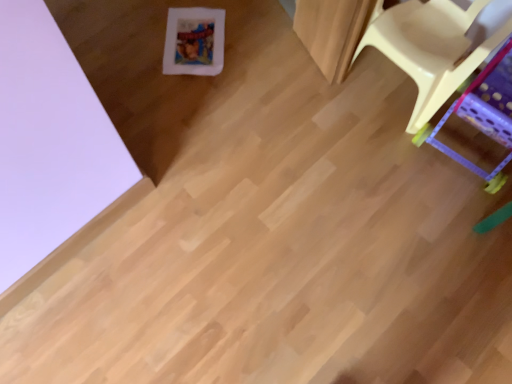
Question: Is matte plastic chair at right, which is the first furniture from left to right, located within yellow plastic chair at right, marked as the second furniture in a left-to-right arrangement?

Choices:
 (A) yes
 (B) no

Answer: (B)

Question: Is yellow plastic chair at right, marked as the second furniture in a left-to-right arrangement, thinner than matte plastic chair at right, which is the first furniture from left to right?

Choices:
 (A) yes
 (B) no

Answer: (B)

Question: From a real-world perspective, is yellow plastic chair at right, marked as the second furniture in a left-to-right arrangement, on matte plastic chair at right, the 2th furniture viewed from the right?

Choices:
 (A) no
 (B) yes

Answer: (A)

Question: Considering the relative sizes of yellow plastic chair at right, marked as the second furniture in a left-to-right arrangement, and matte plastic chair at right, the 2th furniture viewed from the right, in the image provided, is yellow plastic chair at right, marked as the second furniture in a left-to-right arrangement, taller than matte plastic chair at right, the 2th furniture viewed from the right,?

Choices:
 (A) yes
 (B) no

Answer: (B)

Question: Can you confirm if yellow plastic chair at right, marked as the second furniture in a left-to-right arrangement, is shorter than matte plastic chair at right, the 2th furniture viewed from the right?

Choices:
 (A) yes
 (B) no

Answer: (A)

Question: Can you confirm if yellow plastic chair at right, marked as the second furniture in a left-to-right arrangement, is wider than matte plastic chair at right, which is the first furniture from left to right?

Choices:
 (A) yes
 (B) no

Answer: (A)

Question: Is matte plastic chair at right, which is the first furniture from left to right, to the right of yellow plastic chair at right, which appears as the 1th furniture when viewed from the right, from the viewer's perspective?

Choices:
 (A) no
 (B) yes

Answer: (A)

Question: From the image's perspective, is matte plastic chair at right, which is the first furniture from left to right, above yellow plastic chair at right, which appears as the 1th furniture when viewed from the right?

Choices:
 (A) yes
 (B) no

Answer: (A)

Question: Considering the relative sizes of matte plastic chair at right, which is the first furniture from left to right, and yellow plastic chair at right, marked as the second furniture in a left-to-right arrangement, in the image provided, is matte plastic chair at right, which is the first furniture from left to right, shorter than yellow plastic chair at right, marked as the second furniture in a left-to-right arrangement,?

Choices:
 (A) yes
 (B) no

Answer: (B)

Question: Is matte plastic chair at right, the 2th furniture viewed from the right, facing away from yellow plastic chair at right, which appears as the 1th furniture when viewed from the right?

Choices:
 (A) yes
 (B) no

Answer: (B)

Question: From the image's perspective, is matte plastic chair at right, which is the first furniture from left to right, located beneath yellow plastic chair at right, which appears as the 1th furniture when viewed from the right?

Choices:
 (A) no
 (B) yes

Answer: (A)

Question: Does matte plastic chair at right, the 2th furniture viewed from the right, have a smaller size compared to yellow plastic chair at right, marked as the second furniture in a left-to-right arrangement?

Choices:
 (A) yes
 (B) no

Answer: (B)

Question: Is point (498, 213) closer or farther from the camera than point (432, 62)?

Choices:
 (A) closer
 (B) farther

Answer: (B)